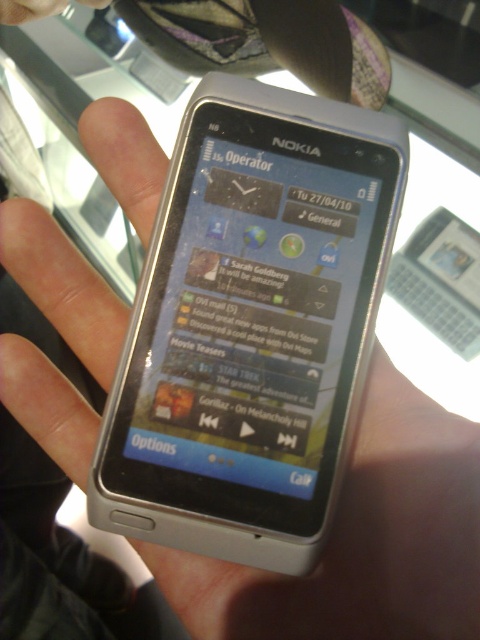
You are a delivery person who needs to place a silver metallic phone at center and a black matte text at upper center on a delivery table. The table is 16 inches wide. Can both items fit side by side on the table without overlapping?

The distance between the silver metallic phone at center and the black matte text at upper center is 14.53 inches. Since the table is 16 inches wide, which is wider than the combined distance of both items, they can fit side by side without overlapping.

You are holding a Nokia N8 smartphone and want to touch the point at coordinates (388, 634). Given that your finger can reach up to 20 inches from the screen, will you be able to reach that point?

The point at coordinates (388, 634) is 20.53 inches from the camera, which exceeds your finger reach limit of 20 inches. Therefore, you won

In the scene shown: You are standing in front of a display case containing the silver metallic phone at center. The display case has a small opening at the bottom for visitors to interact with the phone. If you want to touch the phone, where should you aim your hand relative to the display case?

The silver metallic phone at center is located at point 0.844 on the x axis and 0.754 on the y axis, so you should aim your hand towards the lower central area of the display case to reach it.